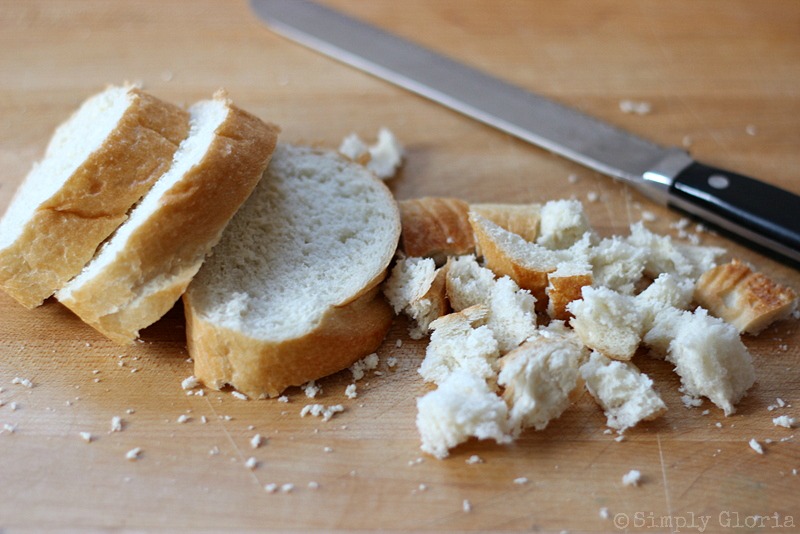
Identify the location of knife handle. The image size is (800, 534). (706, 199).